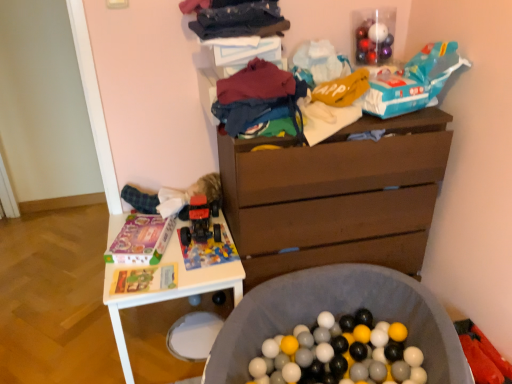
Question: From a real-world perspective, is brick-patterned plastic toy car at center, which ranks as the first toy in bottom-to-top order, positioned over multicolored fabric at center, marked as the 1th clothing in a bottom-to-top arrangement, based on gravity?

Choices:
 (A) yes
 (B) no

Answer: (B)

Question: Does brick-patterned plastic toy car at center, which ranks as the first toy in bottom-to-top order, turn towards multicolored fabric at center, which is counted as the second clothing, starting from the top?

Choices:
 (A) no
 (B) yes

Answer: (A)

Question: From the image's perspective, is brick-patterned plastic toy car at center, which ranks as the first toy in bottom-to-top order, located beneath multicolored fabric at center, which is counted as the second clothing, starting from the top?

Choices:
 (A) yes
 (B) no

Answer: (A)

Question: Considering the relative positions of brick-patterned plastic toy car at center, which ranks as the first toy in bottom-to-top order, and multicolored fabric at center, which is counted as the second clothing, starting from the top, in the image provided, is brick-patterned plastic toy car at center, which ranks as the first toy in bottom-to-top order, to the left of multicolored fabric at center, which is counted as the second clothing, starting from the top, from the viewer's perspective?

Choices:
 (A) yes
 (B) no

Answer: (A)

Question: Is brick-patterned plastic toy car at center, which appears as the second toy when viewed from the right, looking in the opposite direction of multicolored fabric at center, which is counted as the second clothing, starting from the top?

Choices:
 (A) yes
 (B) no

Answer: (B)

Question: Is brick-patterned plastic toy car at center, the 3th toy in the top-to-bottom sequence, beside multicolored fabric at center, marked as the 1th clothing in a bottom-to-top arrangement?

Choices:
 (A) no
 (B) yes

Answer: (A)

Question: From the image's perspective, is brown wooden chest of drawers at center on white plastic table at lower left?

Choices:
 (A) no
 (B) yes

Answer: (B)

Question: Is brown wooden chest of drawers at center aimed at white plastic table at lower left?

Choices:
 (A) no
 (B) yes

Answer: (A)

Question: Can you confirm if brown wooden chest of drawers at center is shorter than white plastic table at lower left?

Choices:
 (A) yes
 (B) no

Answer: (B)

Question: Is brown wooden chest of drawers at center at the right side of white plastic table at lower left?

Choices:
 (A) yes
 (B) no

Answer: (A)

Question: Is brown wooden chest of drawers at center behind white plastic table at lower left?

Choices:
 (A) yes
 (B) no

Answer: (B)

Question: Does brown wooden chest of drawers at center touch white plastic table at lower left?

Choices:
 (A) yes
 (B) no

Answer: (B)

Question: Does multicolored fabric at center, marked as the 1th clothing in a bottom-to-top arrangement, appear on the left side of brick-patterned plastic toy car at center, which appears as the second toy when viewed from the right?

Choices:
 (A) yes
 (B) no

Answer: (B)